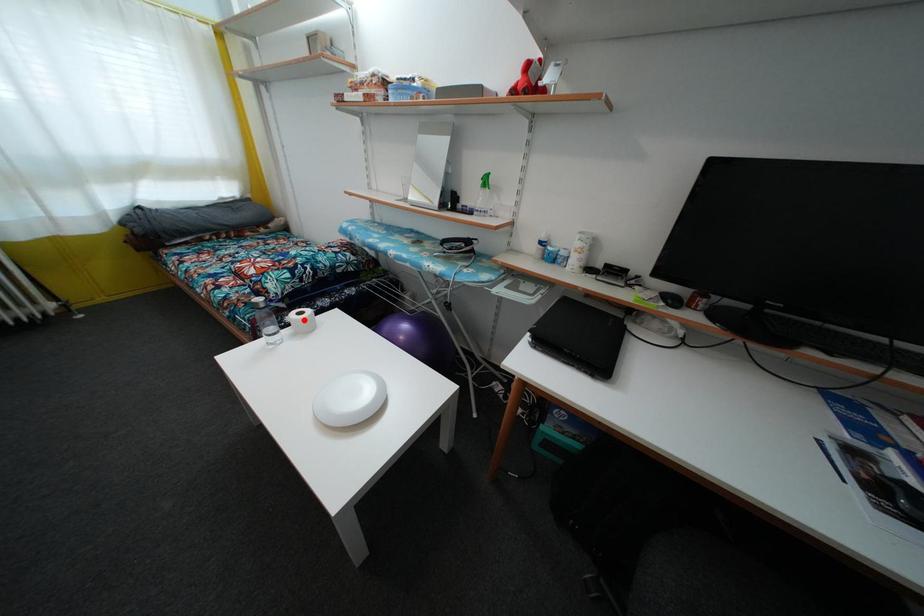
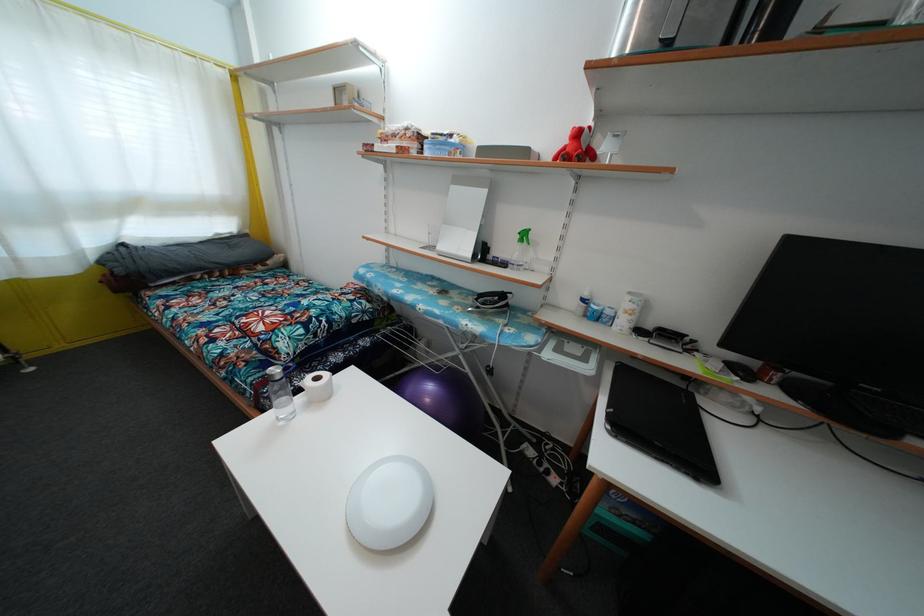
Where in the second image is the point corresponding to the highlighted location from the first image?

(321, 386)